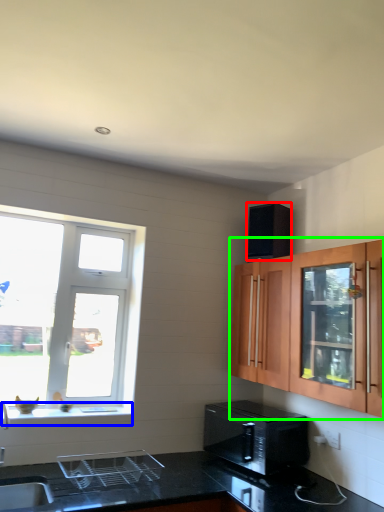
Question: Which object is the closest to the appliance (highlighted by a red box)? Choose among these: window sill (highlighted by a blue box) or cabinetry (highlighted by a green box).

Choices:
 (A) window sill
 (B) cabinetry

Answer: (B)